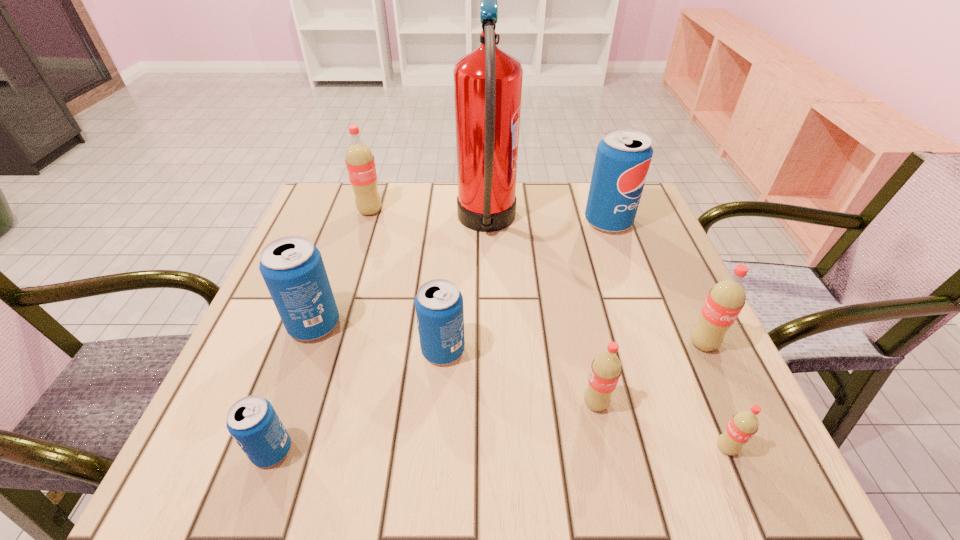
Where is `vacant space located 0.060m on the front of the fourth soda from right to left`? The height and width of the screenshot is (540, 960). vacant space located 0.060m on the front of the fourth soda from right to left is located at coordinates (606, 450).

This screenshot has height=540, width=960. In order to click on free space located 0.280m on the right of the smallest blue soda can in this screenshot , I will do `click(470, 450)`.

Locate an element on the screen. The image size is (960, 540). blank space located on the back of the nearest red soda is located at coordinates (654, 276).

Image resolution: width=960 pixels, height=540 pixels. Find the location of `fire extinguisher at the far edge`. fire extinguisher at the far edge is located at coordinates pyautogui.click(x=488, y=81).

Identify the location of object that is at the far left corner. (360, 163).

This screenshot has width=960, height=540. I want to click on object positioned at the near left corner, so [x=252, y=421].

This screenshot has height=540, width=960. Find the location of `object present at the far right corner`. object present at the far right corner is located at coordinates pos(623,156).

The image size is (960, 540). In order to click on object that is at the near right corner in this screenshot , I will do `click(743, 425)`.

The height and width of the screenshot is (540, 960). Identify the location of free space at the far edge. (420, 225).

Where is `vacant area at the left edge of the desktop`? The image size is (960, 540). vacant area at the left edge of the desktop is located at coordinates (357, 244).